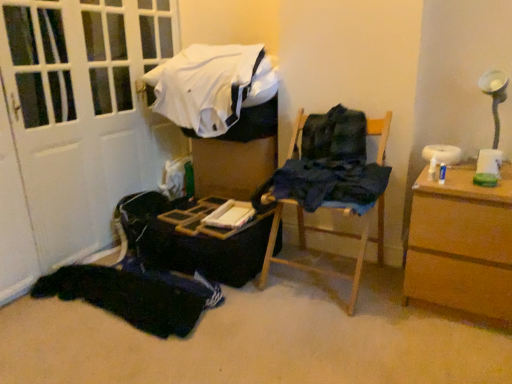
The image size is (512, 384). What are the coordinates of `vacant space in front of brown wooden chest of drawers at right` in the screenshot? It's located at (452, 350).